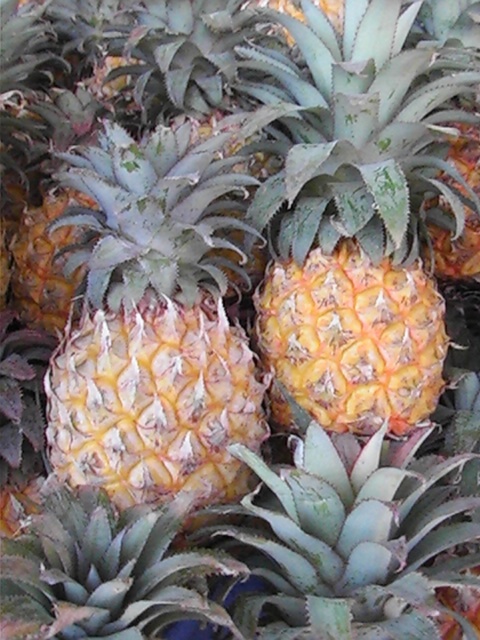
Does yellow matte pineapple at center appear on the right side of yellow textured pineapple at center?

Indeed, yellow matte pineapple at center is positioned on the right side of yellow textured pineapple at center.

What are the coordinates of `yellow matte pineapple at center` in the screenshot? It's located at (355, 218).

Which is in front, point (469, 83) or point (242, 356)?

Point (469, 83) is in front.

Where is `yellow matte pineapple at center`? The height and width of the screenshot is (640, 480). yellow matte pineapple at center is located at coordinates (355, 218).